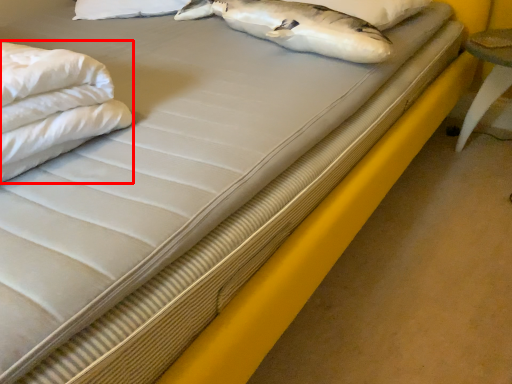
Question: From the image's perspective, considering the relative positions of sheet (annotated by the red box) and pillow in the image provided, where is sheet (annotated by the red box) located with respect to the staircase?

Choices:
 (A) above
 (B) below

Answer: (B)